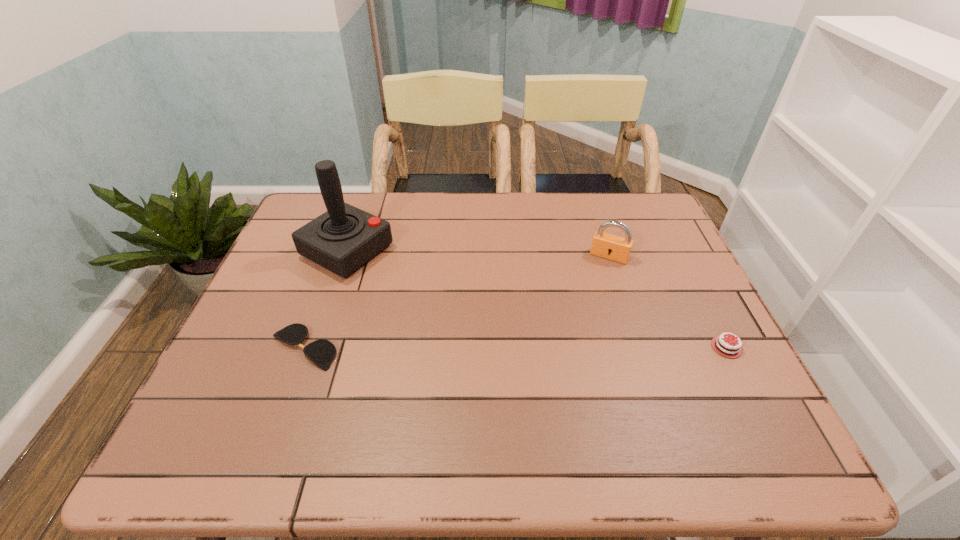
Where is `vacant space at the far edge of the desktop`? vacant space at the far edge of the desktop is located at coordinates (601, 210).

Where is `vacant area at the near edge`? vacant area at the near edge is located at coordinates (449, 411).

Image resolution: width=960 pixels, height=540 pixels. Identify the location of free space at the left edge of the desktop. (307, 275).

This screenshot has width=960, height=540. In the image, there is a desktop. In order to click on vacant space at the right edge in this screenshot , I will do `click(682, 259)`.

You are a GUI agent. You are given a task and a screenshot of the screen. Output one action in this format:
    pyautogui.click(x=<x>, y=<y>)
    Task: Click on the free space at the near left corner of the desktop
    This screenshot has height=540, width=960.
    Given the screenshot: What is the action you would take?
    pyautogui.click(x=229, y=394)

This screenshot has height=540, width=960. I want to click on vacant area at the near right corner, so click(688, 400).

Where is `vacant region between the second tallest object and the spectacles`? This screenshot has width=960, height=540. vacant region between the second tallest object and the spectacles is located at coordinates (456, 302).

Where is `vacant region between the shortest object and the second shortest object`? This screenshot has height=540, width=960. vacant region between the shortest object and the second shortest object is located at coordinates (515, 347).

Locate an element on the screen. The image size is (960, 540). vacant space that's between the spectacles and the padlock is located at coordinates (456, 302).

In order to click on free space between the third shortest object and the second shortest object in this screenshot , I will do `click(668, 302)`.